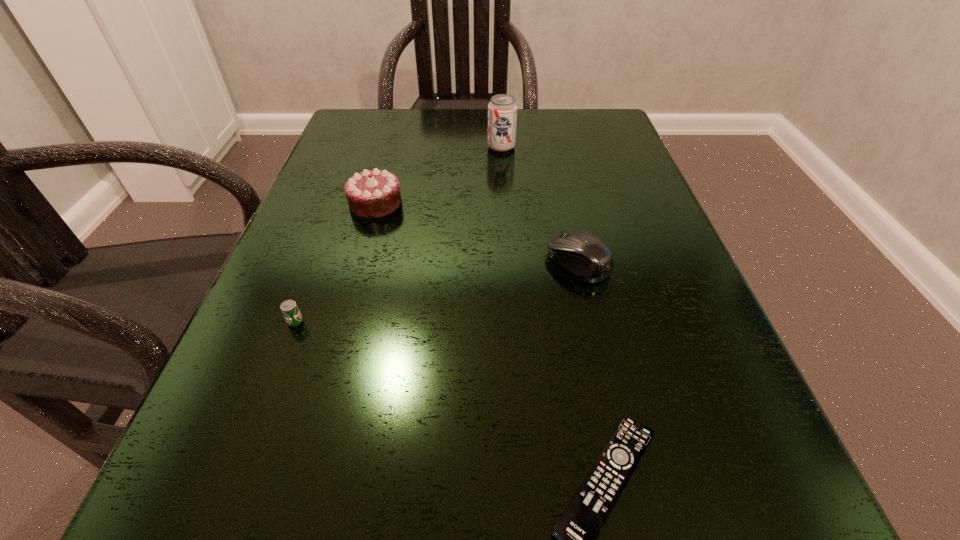
In the image, there is a desktop. Where is `vacant area at the far right corner`? vacant area at the far right corner is located at coordinates (563, 138).

This screenshot has width=960, height=540. I want to click on free space that is in between the left beer can and the fourth shortest object, so click(335, 262).

Locate an element on the screen. free space between the nearer beer can and the chocolate cake is located at coordinates [335, 262].

At what (x,y) coordinates should I click in order to perform the action: click on free spot between the second farthest object and the mouse. Please return your answer as a coordinate pair (x, y). The width and height of the screenshot is (960, 540). Looking at the image, I should click on (477, 233).

The image size is (960, 540). Identify the location of free area in between the second shortest object and the mouse. coord(437,292).

I want to click on free space between the right beer can and the second tallest object, so (x=439, y=176).

At what (x,y) coordinates should I click in order to perform the action: click on vacant point located between the third tallest object and the tallest object. Please return your answer as a coordinate pair (x, y). Image resolution: width=960 pixels, height=540 pixels. Looking at the image, I should click on (540, 205).

Find the location of `empty location between the second farthest object and the farthest object`. empty location between the second farthest object and the farthest object is located at coordinates (439, 176).

You are a GUI agent. You are given a task and a screenshot of the screen. Output one action in this format:
    pyautogui.click(x=<x>, y=<y>)
    Task: Click on the object that can be found as the closest to the shortest object
    
    Given the screenshot: What is the action you would take?
    pyautogui.click(x=582, y=254)

Identify which object is the fourth closest to the remote control. Please provide its 2D coordinates. Your answer should be formatted as a tuple, i.e. [(x, y)], where the tuple contains the x and y coordinates of a point satisfying the conditions above.

[(502, 110)]